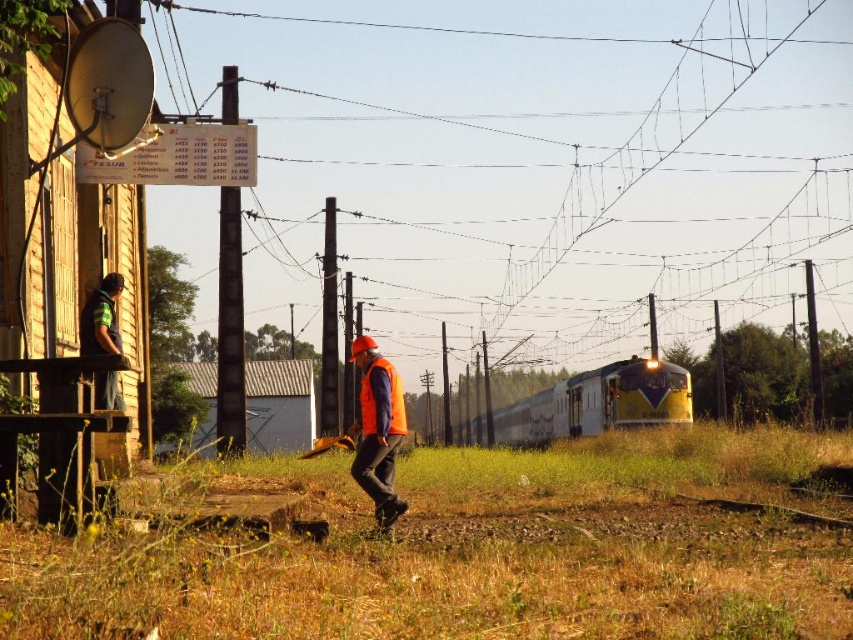
Is yellow metallic train at center further to the viewer compared to orange matte safety vest at center?

Yes, yellow metallic train at center is further from the viewer.

Can you confirm if yellow metallic train at center is bigger than orange matte safety vest at center?

Indeed, yellow metallic train at center has a larger size compared to orange matte safety vest at center.

Locate an element on the screen. The image size is (853, 640). yellow metallic train at center is located at coordinates (596, 403).

Does orange reflective vest at center appear under orange matte safety vest at center?

Yes, orange reflective vest at center is below orange matte safety vest at center.

Is orange reflective vest at center bigger than orange matte safety vest at center?

Correct, orange reflective vest at center is larger in size than orange matte safety vest at center.

Locate an element on the screen. orange reflective vest at center is located at coordinates (378, 429).

Can you confirm if yellow metallic train at center is positioned to the left of orange reflective vest at center?

Incorrect, yellow metallic train at center is not on the left side of orange reflective vest at center.

This screenshot has width=853, height=640. I want to click on yellow metallic train at center, so click(596, 403).